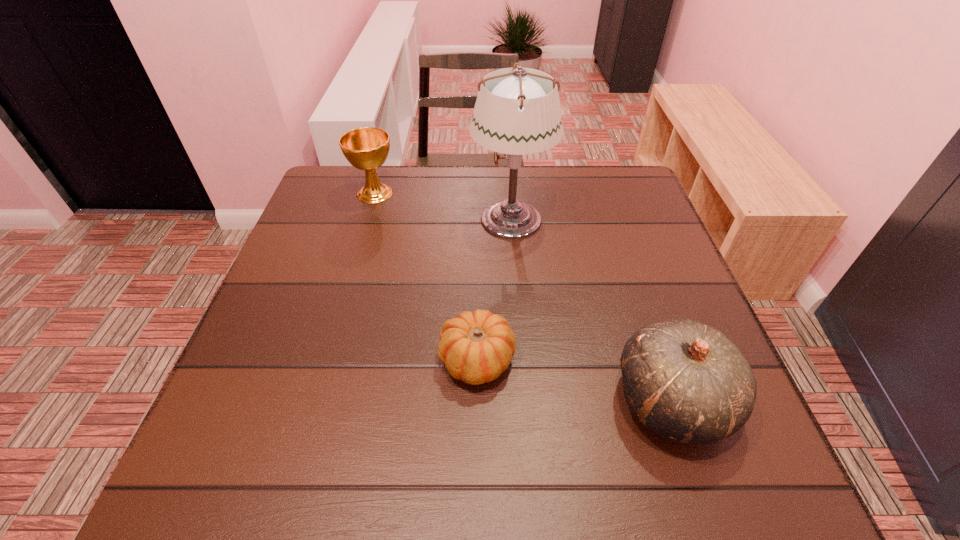
What are the coordinates of `the tallest object` in the screenshot? It's located at (517, 112).

Where is `chalice`? This screenshot has height=540, width=960. chalice is located at coordinates (366, 148).

This screenshot has height=540, width=960. In order to click on the rightmost object in this screenshot , I will do `click(686, 381)`.

In order to click on the right gourd in this screenshot , I will do `click(686, 381)`.

What are the coordinates of `the shortest object` in the screenshot? It's located at pyautogui.click(x=477, y=347).

At what (x,y) coordinates should I click in order to perform the action: click on the shorter gourd. Please return your answer as a coordinate pair (x, y). The height and width of the screenshot is (540, 960). Looking at the image, I should click on (477, 347).

At what (x,y) coordinates should I click in order to perform the action: click on vacant space situated 0.400m on the lampshade of the lampshade. Please return your answer as a coordinate pair (x, y). Looking at the image, I should click on (317, 219).

Identify the location of free location located on the lampshade of the lampshade. (382, 219).

The image size is (960, 540). In order to click on free space located on the lampshade of the lampshade in this screenshot , I will do `click(432, 219)`.

Where is `vacant space located on the left of the leftmost object`? vacant space located on the left of the leftmost object is located at coordinates (327, 193).